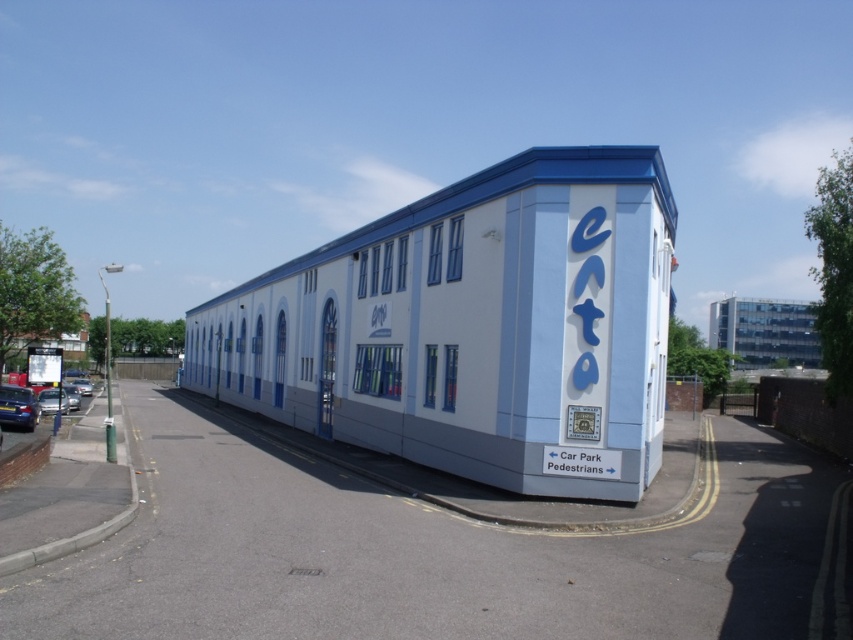
You are standing at the point closest to the building. Which point, point (24, 429) or point (71, 385), is closer to you?

Point (24, 429) is in front of point (71, 385), so it is closer to you.